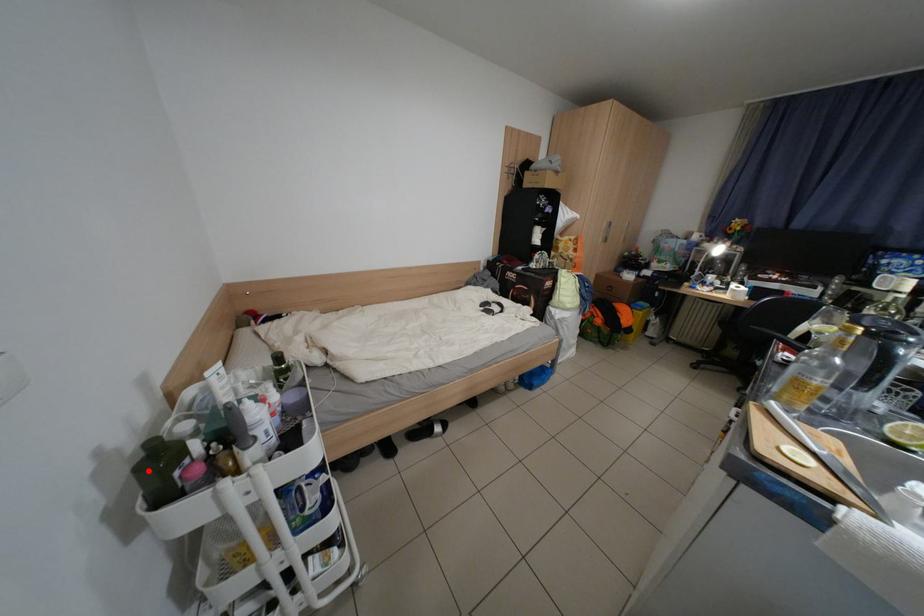
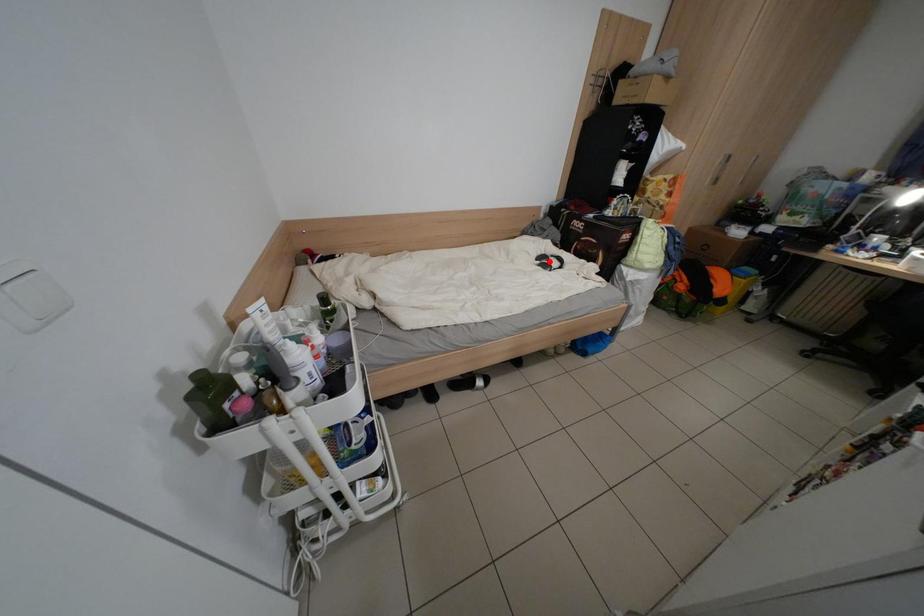
I am providing you with two images of the same scene from different viewpoints. A red point is marked on the first image and another point is marked on the second image. Are the points marked in image1 and image2 representing the same 3D position?

No